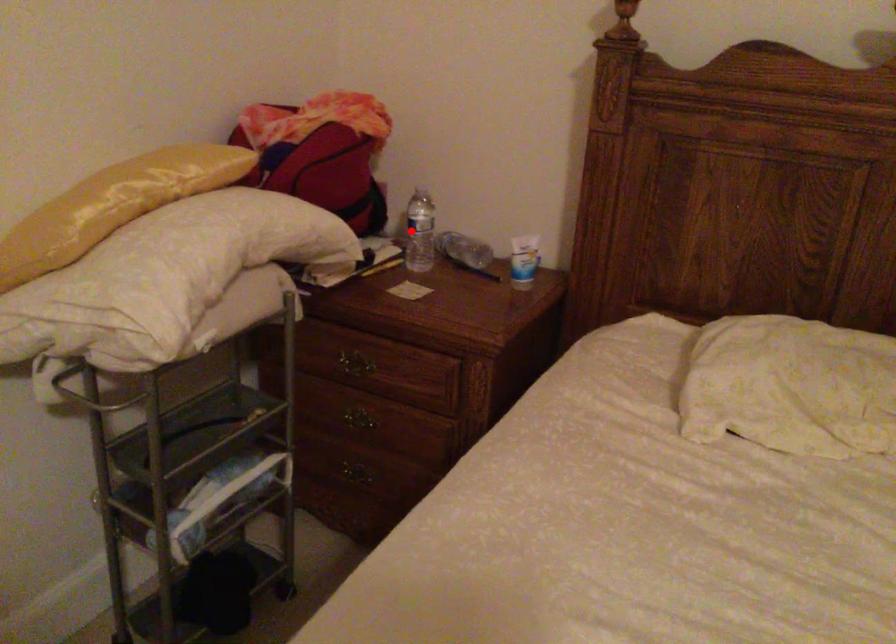
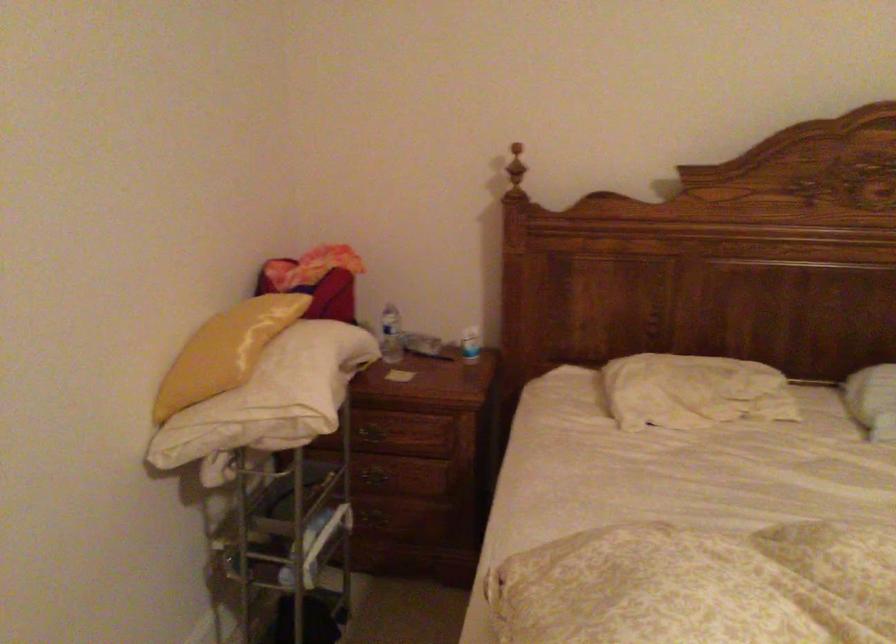
In the second image, find the point that corresponds to the highlighted location in the first image.

(391, 335)